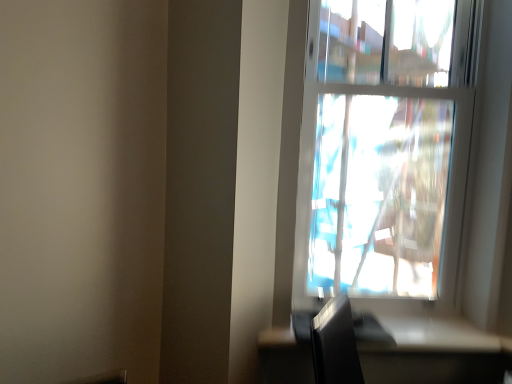
Where is `vacant location below transparent glass window at upper right (from a real-world perspective)`? vacant location below transparent glass window at upper right (from a real-world perspective) is located at coordinates (411, 317).